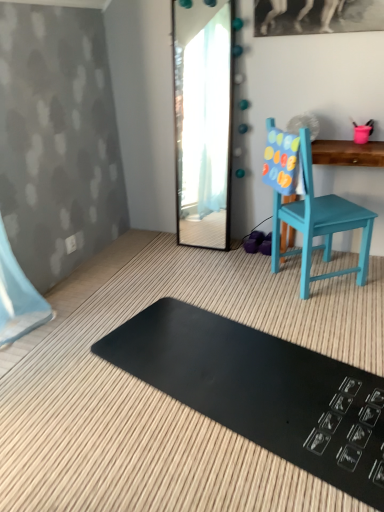
Question: From the image's perspective, is clear glass mirror at center positioned above or below teal painted wood changing table at right?

Choices:
 (A) below
 (B) above

Answer: (B)

Question: Is clear glass mirror at center bigger or smaller than teal painted wood changing table at right?

Choices:
 (A) small
 (B) big

Answer: (A)

Question: Which of these objects is positioned closest to the teal painted wood changing table at right?

Choices:
 (A) clear glass mirror at center
 (B) black rubber mat at lower center
 (C) teal painted wood chair at right

Answer: (C)

Question: Which object is positioned farthest from the teal painted wood chair at right?

Choices:
 (A) clear glass mirror at center
 (B) black rubber mat at lower center
 (C) teal painted wood changing table at right

Answer: (A)